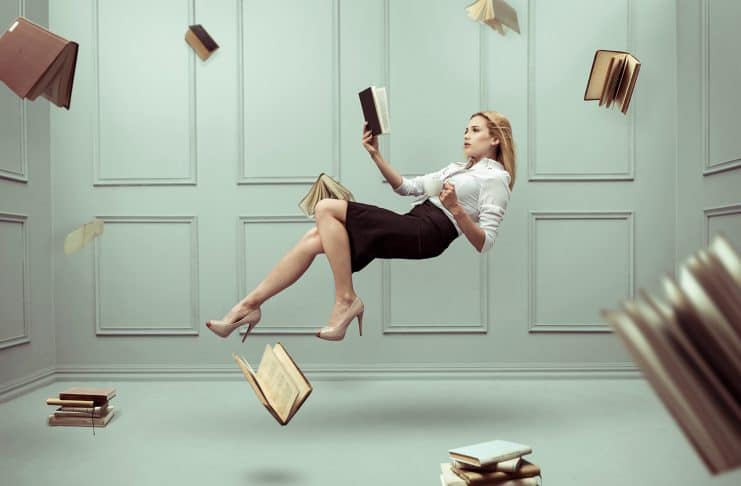
At what (x,y) coordinates should I click in order to perform the action: click on wall. Please return your answer as a coordinate pair (x, y). The height and width of the screenshot is (486, 741). Looking at the image, I should click on (216, 127).